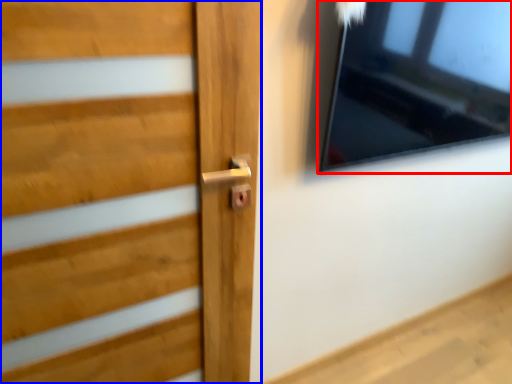
Question: Which object appears farthest to the camera in this image, window (highlighted by a red box) or door (highlighted by a blue box)?

Choices:
 (A) window
 (B) door

Answer: (A)